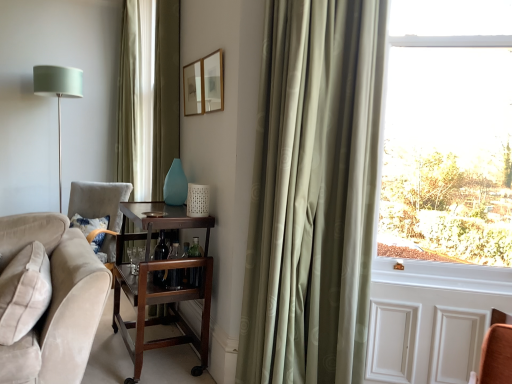
Question: Is satin green curtain at right further to camera compared to mahogany wood bar cart at center?

Choices:
 (A) no
 (B) yes

Answer: (A)

Question: Does satin green curtain at right have a greater height compared to mahogany wood bar cart at center?

Choices:
 (A) yes
 (B) no

Answer: (A)

Question: Does satin green curtain at right have a greater width compared to mahogany wood bar cart at center?

Choices:
 (A) no
 (B) yes

Answer: (A)

Question: Is mahogany wood bar cart at center at the back of satin green curtain at right?

Choices:
 (A) no
 (B) yes

Answer: (A)

Question: From a real-world perspective, is satin green curtain at right on mahogany wood bar cart at center?

Choices:
 (A) no
 (B) yes

Answer: (B)

Question: Is satin green curtain at right beside mahogany wood bar cart at center?

Choices:
 (A) yes
 (B) no

Answer: (B)

Question: From a real-world perspective, is transparent glass window at right under matte wooden picture frame at upper center, the second picture frame viewed from the left?

Choices:
 (A) no
 (B) yes

Answer: (B)

Question: Is transparent glass window at right at the left side of matte wooden picture frame at upper center, the second picture frame viewed from the left?

Choices:
 (A) yes
 (B) no

Answer: (B)

Question: Can you confirm if transparent glass window at right is smaller than matte wooden picture frame at upper center, the second picture frame viewed from the left?

Choices:
 (A) no
 (B) yes

Answer: (A)

Question: Can matte wooden picture frame at upper center, the second picture frame viewed from the left, be found inside transparent glass window at right?

Choices:
 (A) yes
 (B) no

Answer: (B)

Question: Is transparent glass window at right closer to the viewer compared to matte wooden picture frame at upper center, the second picture frame positioned from the back?

Choices:
 (A) yes
 (B) no

Answer: (A)

Question: Is transparent glass window at right looking in the opposite direction of matte wooden picture frame at upper center, the second picture frame positioned from the back?

Choices:
 (A) no
 (B) yes

Answer: (A)

Question: From a real-world perspective, is matte green shade at left physically below transparent glass window at right?

Choices:
 (A) yes
 (B) no

Answer: (A)